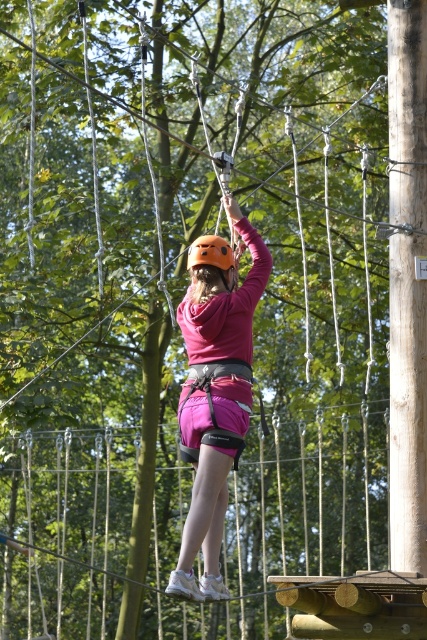
You are an observer looking at the ropes course participant. Which object, the pink matte shorts at center or the orange matte helmet at center, appears taller in the image?

The pink matte shorts at center appears taller than the orange matte helmet at center in the image.

You are designing a safety inspection checklist for the ropes course. You need to ensure that the smooth brown wooden pole at right and the pink matte shorts at center are both visible to safety observers. Which object should you prioritize for visibility improvements?

The smooth brown wooden pole at right should be prioritized for visibility improvements because it occupies less space than the pink matte shorts at center, making it harder to notice from a distance.

You are a safety inspector checking the ropes course setup. You notice the pink matte shorts at center and orange matte helmet at center. Based on their positions, which one is closer to the ground?

The pink matte shorts at center is below orange matte helmet at center, so the pink matte shorts at center is closer to the ground.